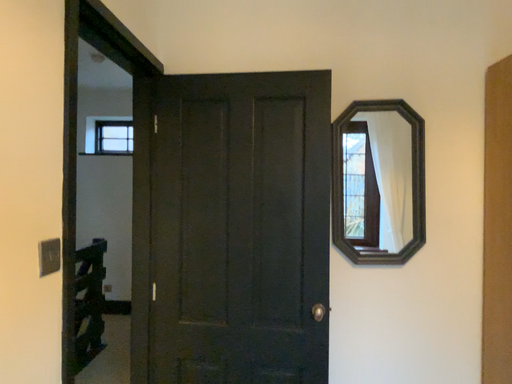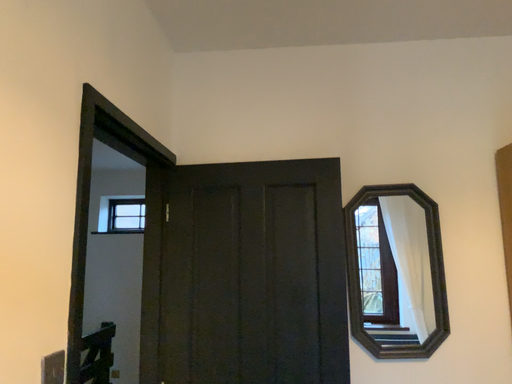
Question: Which way did the camera rotate in the video?

Choices:
 (A) rotated downward
 (B) rotated upward

Answer: (B)